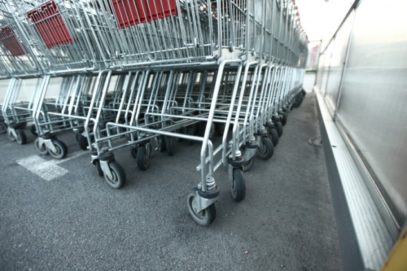
You are a GUI agent. You are given a task and a screenshot of the screen. Output one action in this format:
    pyautogui.click(x=<x>, y=<y>)
    Task: Click on the 1 wall
    This screenshot has height=271, width=407.
    Given the screenshot: What is the action you would take?
    pyautogui.click(x=380, y=103)